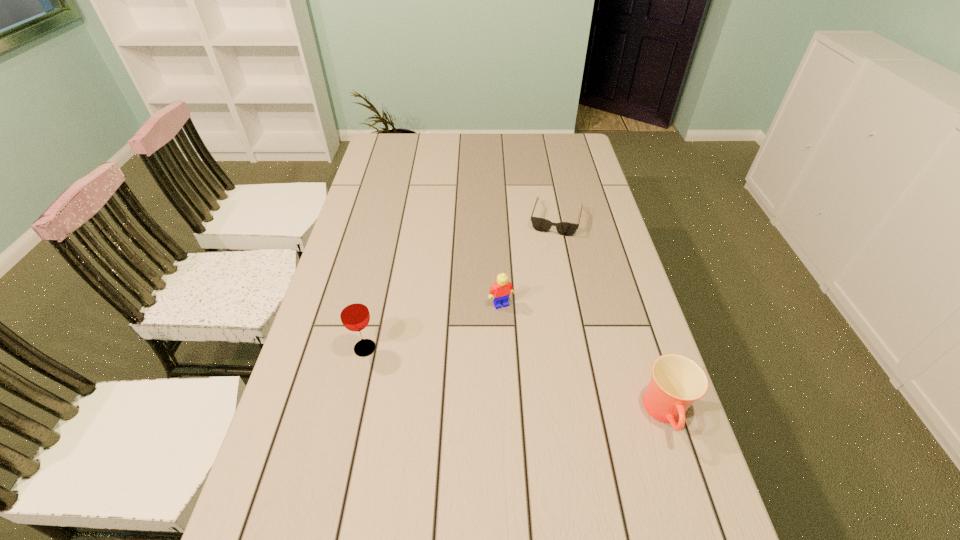
Locate an element on the screen. free space at the near edge of the desktop is located at coordinates (535, 509).

This screenshot has height=540, width=960. In order to click on vacant space at the left edge in this screenshot , I will do `click(345, 456)`.

Identify the location of free location at the right edge. (x=595, y=313).

Where is `vacant area at the far left corner of the desktop`? Image resolution: width=960 pixels, height=540 pixels. vacant area at the far left corner of the desktop is located at coordinates point(413,146).

The image size is (960, 540). Find the location of `vacant space at the near left corner of the desktop`. vacant space at the near left corner of the desktop is located at coordinates (304, 508).

Locate an element on the screen. The width and height of the screenshot is (960, 540). vacant area between the shortest object and the second nearest object is located at coordinates (461, 284).

The image size is (960, 540). In order to click on vacant point located between the Lego and the second object from right to left in this screenshot , I will do `click(529, 261)`.

Image resolution: width=960 pixels, height=540 pixels. I want to click on vacant area that lies between the cup and the second farthest object, so click(x=584, y=359).

Where is `empty location between the rightmost object and the second nearest object`? Image resolution: width=960 pixels, height=540 pixels. empty location between the rightmost object and the second nearest object is located at coordinates (516, 381).

Locate an element on the screen. This screenshot has width=960, height=540. unoccupied area between the second object from right to left and the nearest object is located at coordinates (612, 316).